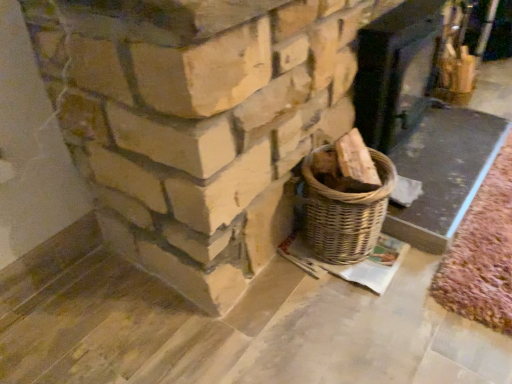
Question: Considering their positions, is smooth dark wood fireplace at upper right, which is the 2th fireplace in left-to-right order, located in front of or behind natural stone fireplace at upper left, acting as the 2th fireplace starting from the right?

Choices:
 (A) front
 (B) behind

Answer: (B)

Question: Do you think smooth dark wood fireplace at upper right, which is the 2th fireplace in left-to-right order, is within natural stone fireplace at upper left, acting as the 2th fireplace starting from the right, or outside of it?

Choices:
 (A) inside
 (B) outside

Answer: (B)

Question: Is smooth dark wood fireplace at upper right, acting as the first fireplace starting from the right, wider or thinner than natural stone fireplace at upper left, acting as the 2th fireplace starting from the right?

Choices:
 (A) wide
 (B) thin

Answer: (A)

Question: Is natural stone fireplace at upper left, acting as the 2th fireplace starting from the right, situated inside smooth dark wood fireplace at upper right, acting as the first fireplace starting from the right, or outside?

Choices:
 (A) inside
 (B) outside

Answer: (B)

Question: In the image, is natural stone fireplace at upper left, acting as the 2th fireplace starting from the right, positioned in front of or behind smooth dark wood fireplace at upper right, which is the 2th fireplace in left-to-right order?

Choices:
 (A) behind
 (B) front

Answer: (B)

Question: From a real-world perspective, is natural stone fireplace at upper left, which ranks as the 1th fireplace in left-to-right order, physically located above or below smooth dark wood fireplace at upper right, acting as the first fireplace starting from the right?

Choices:
 (A) above
 (B) below

Answer: (A)

Question: From the image's perspective, is natural stone fireplace at upper left, which ranks as the 1th fireplace in left-to-right order, located above or below smooth dark wood fireplace at upper right, acting as the first fireplace starting from the right?

Choices:
 (A) below
 (B) above

Answer: (A)